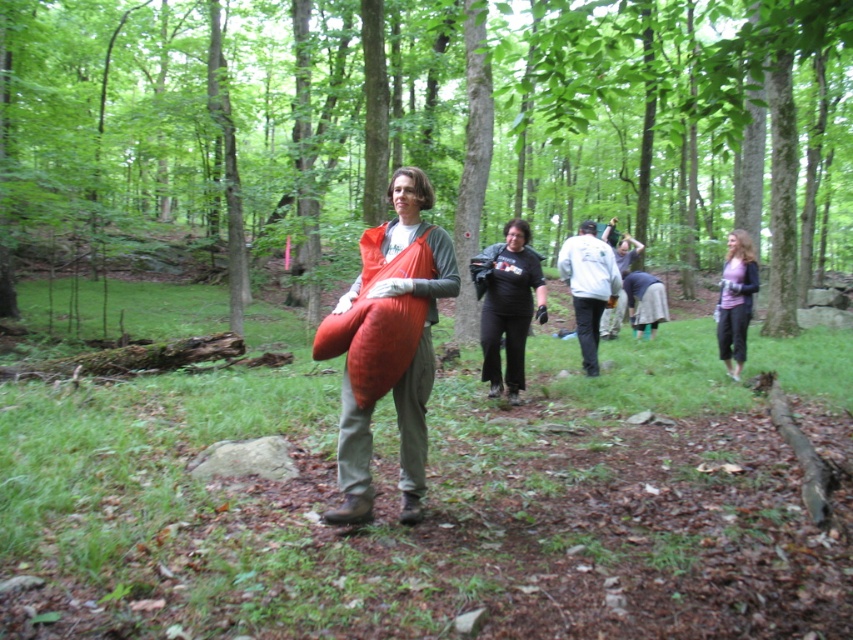
You are a hiker planning to walk through the forest path between the green leafy tree at center and the matte pink sweater at right. Can you pass through the space between them?

The green leafy tree at center is wider than the matte pink sweater at right, so the space between them may be narrow but passable depending on the exact distance. However, the description only mentions their widths, not the distance between them. Without knowing the distance, it is uncertain if the path is wide enough for a hiker to pass through safely.